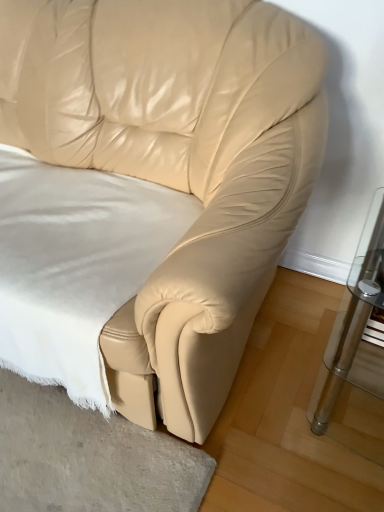
Where is `vacant space behind clear glass table at right`? vacant space behind clear glass table at right is located at coordinates coord(307,304).